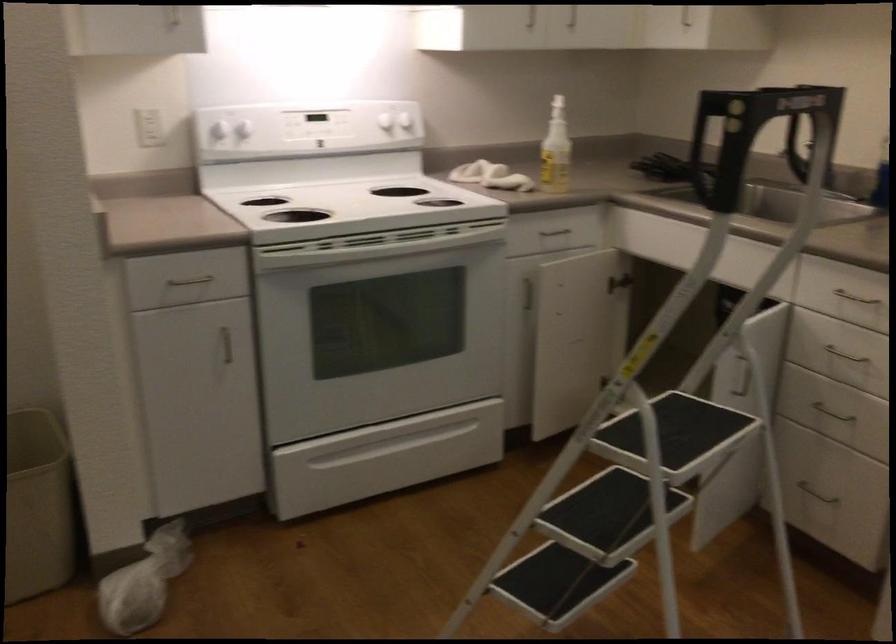
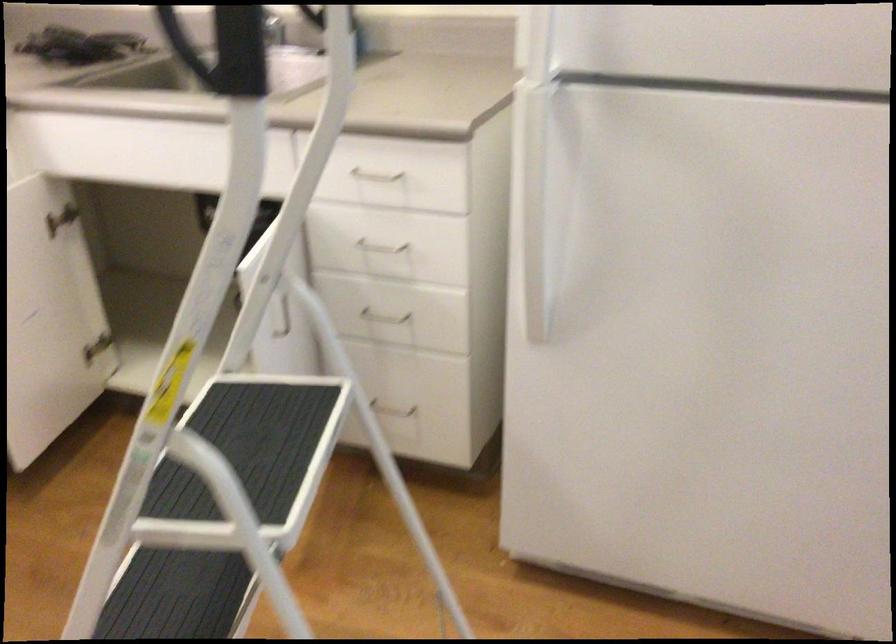
Find the pixel in the second image that matches [821,498] in the first image.

(393, 413)